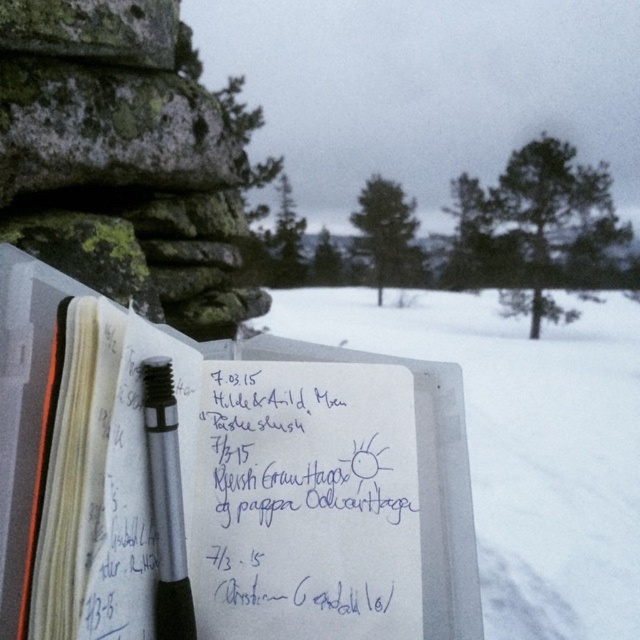
You need to place a bookmark that is 10 cm tall on the white paper notebook at center or the silver metallic pen at center. Which object can the bookmark fit vertically on top of without hanging off?

The white paper notebook at center has a greater height compared to the silver metallic pen at center, so the bookmark can fit vertically on the white paper notebook at center.

You are organizing your desk and notice the white paper notebook at center and the white paper at center. Which one is positioned higher?

The white paper notebook at center is above the white paper at center.